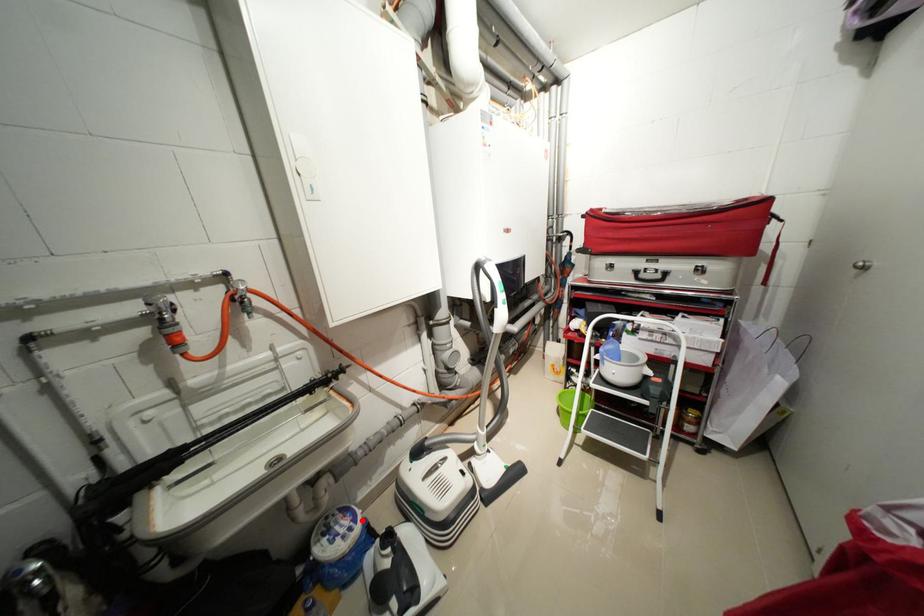
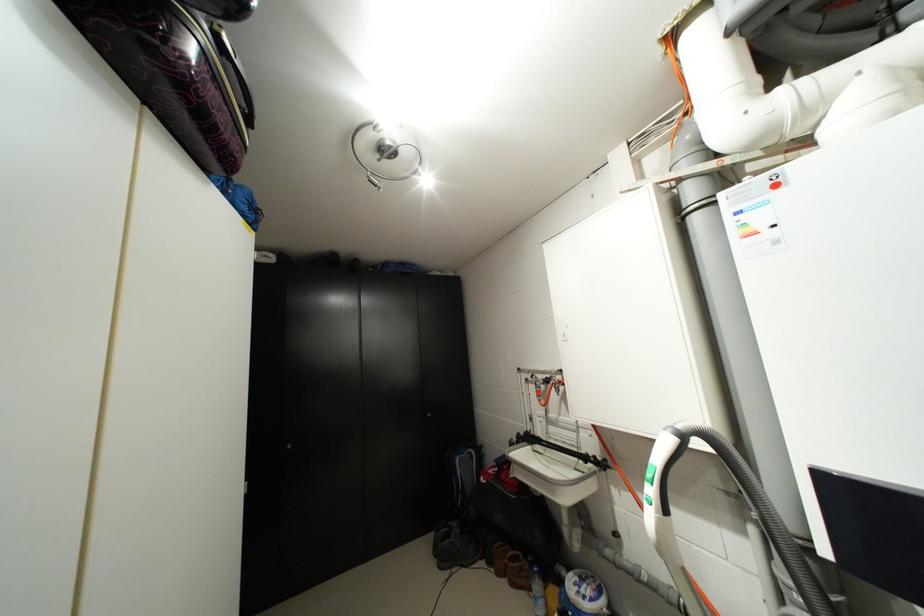
Where in the second image is the point corresponding to the highlighted location from the first image?

(599, 600)